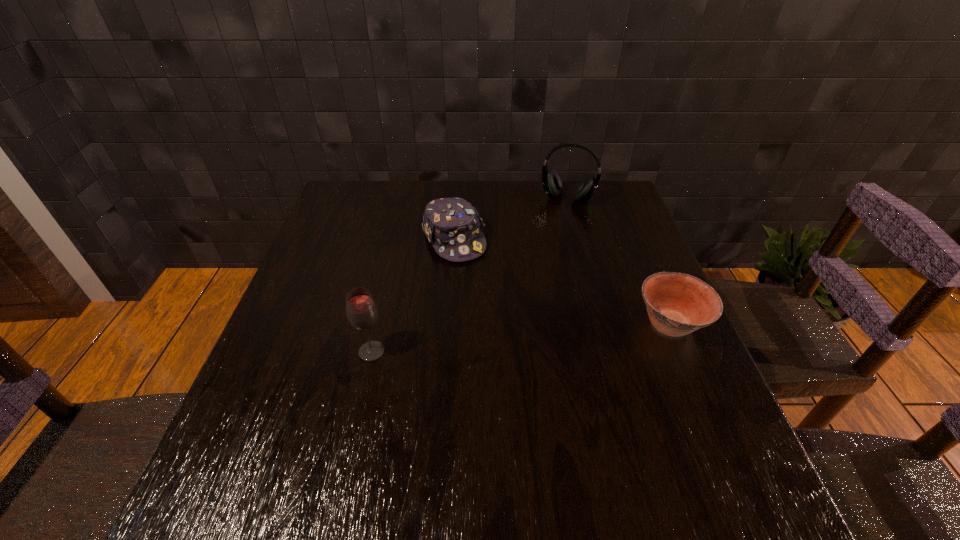
Find the location of a particular element. The width and height of the screenshot is (960, 540). the leftmost object is located at coordinates point(361,311).

The width and height of the screenshot is (960, 540). I want to click on bowl, so click(677, 304).

The image size is (960, 540). In order to click on headset in this screenshot , I will do `click(551, 181)`.

This screenshot has height=540, width=960. What are the coordinates of `the second object from left to right` in the screenshot? It's located at (452, 225).

Identify the location of headwear. (452, 225).

You are a GUI agent. You are given a task and a screenshot of the screen. Output one action in this format:
    pyautogui.click(x=<x>, y=<y>)
    Task: Click on the vacant area situated on the front of the glass drink container
    Image resolution: width=960 pixels, height=540 pixels.
    Given the screenshot: What is the action you would take?
    pyautogui.click(x=353, y=434)

You are a GUI agent. You are given a task and a screenshot of the screen. Output one action in this format:
    pyautogui.click(x=<x>, y=<y>)
    Task: Click on the free space located on the left of the bowl
    This screenshot has height=540, width=960.
    Given the screenshot: What is the action you would take?
    pyautogui.click(x=560, y=324)

This screenshot has height=540, width=960. In order to click on vacant space located 0.050m on the ear cups of the headset in this screenshot , I will do `click(559, 218)`.

Find the location of a particular element. The height and width of the screenshot is (540, 960). free space located 0.190m on the ear cups of the headset is located at coordinates (549, 245).

Find the location of a particular element. The image size is (960, 540). vacant region located 0.290m on the ear cups of the headset is located at coordinates (541, 267).